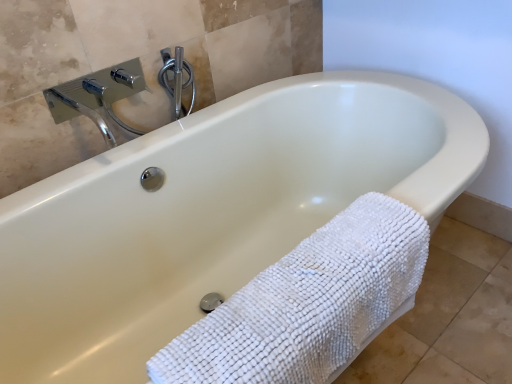
Question: Based on their positions, is white textured towel at lower right located to the left or right of polished chrome shower at upper center?

Choices:
 (A) left
 (B) right

Answer: (B)

Question: From a real-world perspective, relative to polished chrome shower at upper center, is white textured towel at lower right vertically above or below?

Choices:
 (A) below
 (B) above

Answer: (A)

Question: Considering their positions, is white textured towel at lower right located in front of or behind polished chrome shower at upper center?

Choices:
 (A) front
 (B) behind

Answer: (A)

Question: Which is correct: polished chrome shower at upper center is inside white textured towel at lower right, or outside of it?

Choices:
 (A) outside
 (B) inside

Answer: (A)

Question: From a real-world perspective, is polished chrome shower at upper center above or below white textured towel at lower right?

Choices:
 (A) below
 (B) above

Answer: (B)

Question: From the image's perspective, is polished chrome shower at upper center located above or below white textured towel at lower right?

Choices:
 (A) above
 (B) below

Answer: (A)

Question: Considering the positions of polished chrome shower at upper center and white textured towel at lower right in the image, is polished chrome shower at upper center wider or thinner than white textured towel at lower right?

Choices:
 (A) thin
 (B) wide

Answer: (A)